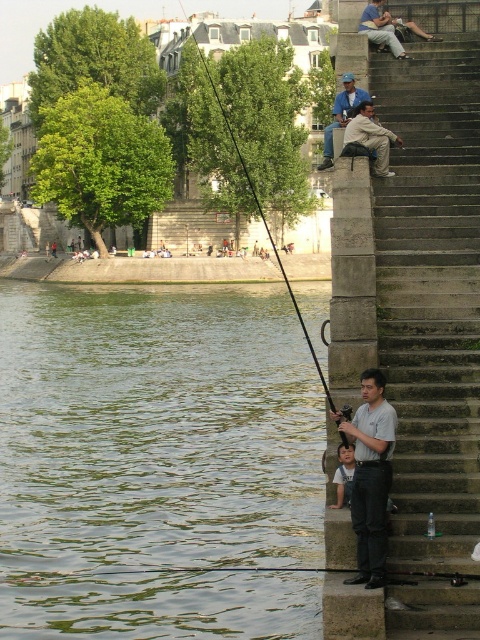
Is greenish water at lower left below blue denim jacket at upper center?

Yes, greenish water at lower left is below blue denim jacket at upper center.

Does greenish water at lower left have a lesser height compared to blue denim jacket at upper center?

Correct, greenish water at lower left is not as tall as blue denim jacket at upper center.

Is point (43, 362) positioned in front of point (364, 96)?

No, (43, 362) is behind (364, 96).

Locate an element on the screen. Image resolution: width=480 pixels, height=640 pixels. greenish water at lower left is located at coordinates (156, 464).

Does gray cotton shirt at lower right have a larger size compared to blue denim jacket at upper center?

No.

Who is more distant from viewer, [384,406] or [327,131]?

Positioned behind is point [327,131].

This screenshot has width=480, height=640. I want to click on gray cotton shirt at lower right, so click(x=371, y=476).

Between gray cotton shirt at lower right and light blue cotton shirt at lower center, which one is positioned lower?

Positioned lower is light blue cotton shirt at lower center.

Is gray cotton shirt at lower right smaller than light blue cotton shirt at lower center?

No, gray cotton shirt at lower right is not smaller than light blue cotton shirt at lower center.

Describe the element at coordinates (371, 476) in the screenshot. The image size is (480, 640). I see `gray cotton shirt at lower right` at that location.

Where is `gray cotton shirt at lower right`? Image resolution: width=480 pixels, height=640 pixels. gray cotton shirt at lower right is located at coordinates (371, 476).